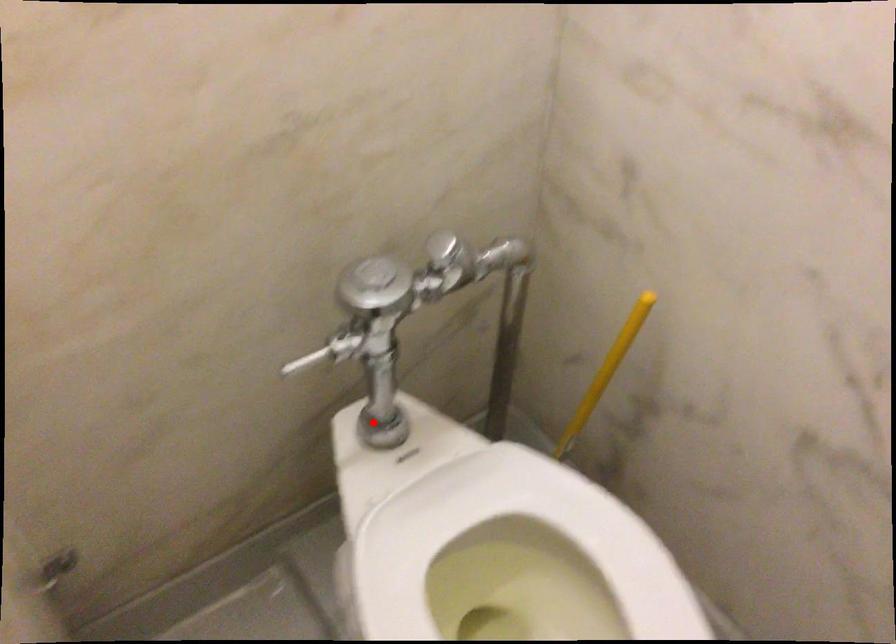
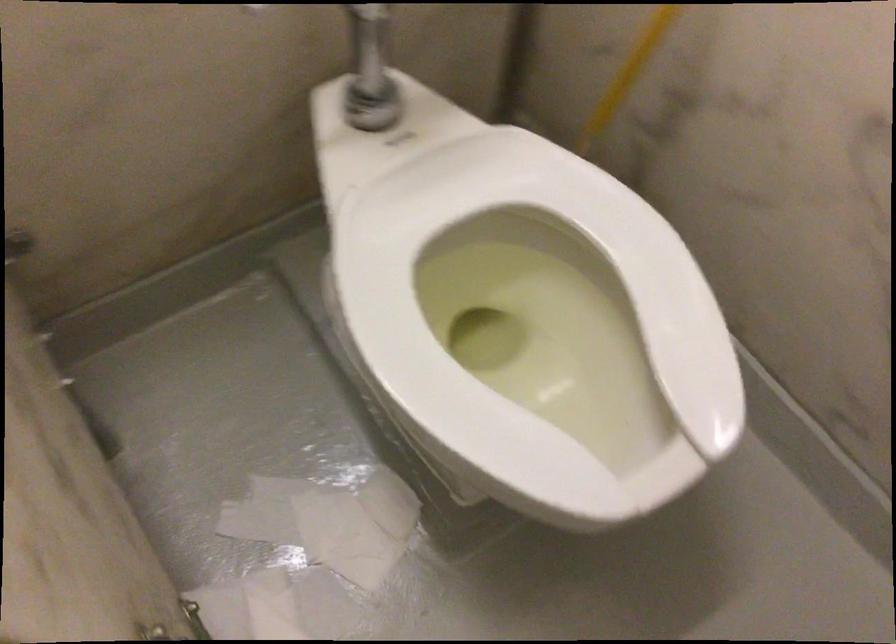
In the second image, find the point that corresponds to the highlighted location in the first image.

(362, 96)